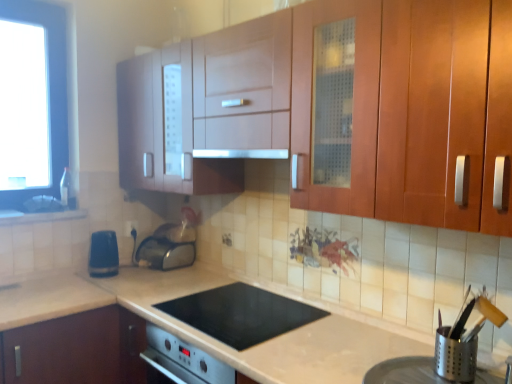
Question: Is silver metallic utensil holder at lower right, placed as the 4th appliance when sorted from left to right, far from blue plastic electric outlet at lower left?

Choices:
 (A) no
 (B) yes

Answer: (B)

Question: Could you tell me if silver metallic utensil holder at lower right, which appears as the third appliance when viewed from the back, is turned towards blue plastic electric outlet at lower left?

Choices:
 (A) no
 (B) yes

Answer: (A)

Question: Can you confirm if silver metallic utensil holder at lower right, which appears as the third appliance when viewed from the back, is wider than blue plastic electric outlet at lower left?

Choices:
 (A) no
 (B) yes

Answer: (B)

Question: From a real-world perspective, is silver metallic utensil holder at lower right, placed as the 4th appliance when sorted from left to right, located higher than blue plastic electric outlet at lower left?

Choices:
 (A) no
 (B) yes

Answer: (A)

Question: Is blue plastic electric outlet at lower left located within silver metallic utensil holder at lower right, which appears as the third appliance when viewed from the back?

Choices:
 (A) yes
 (B) no

Answer: (B)

Question: Based on their positions, is white glossy sink at lower left located to the left or right of blue plastic electric outlet at lower left?

Choices:
 (A) right
 (B) left

Answer: (B)

Question: Considering the positions of white glossy sink at lower left and blue plastic electric outlet at lower left in the image, is white glossy sink at lower left taller or shorter than blue plastic electric outlet at lower left?

Choices:
 (A) short
 (B) tall

Answer: (A)

Question: From a real-world perspective, is white glossy sink at lower left physically located above or below blue plastic electric outlet at lower left?

Choices:
 (A) below
 (B) above

Answer: (B)

Question: From the image's perspective, is white glossy sink at lower left positioned above or below blue plastic electric outlet at lower left?

Choices:
 (A) below
 (B) above

Answer: (B)

Question: From a real-world perspective, relative to satin silver toaster at lower center, positioned as the fourth appliance in front-to-back order, is silver metallic utensil holder at lower right, which is the 4th appliance in back-to-front order, vertically above or below?

Choices:
 (A) below
 (B) above

Answer: (A)

Question: Is point (370, 380) positioned closer to the camera than point (188, 258)?

Choices:
 (A) closer
 (B) farther

Answer: (A)

Question: Is silver metallic utensil holder at lower right, the third appliance positioned from the left, in front of or behind satin silver toaster at lower center, positioned as the fourth appliance in front-to-back order, in the image?

Choices:
 (A) front
 (B) behind

Answer: (A)

Question: Do you think silver metallic utensil holder at lower right, which is the 4th appliance in back-to-front order, is within satin silver toaster at lower center, which is the third appliance in right-to-left order, or outside of it?

Choices:
 (A) inside
 (B) outside

Answer: (B)

Question: From a real-world perspective, is black glass cooktop at center above or below blue plastic kettle at lower left, the first appliance from the left?

Choices:
 (A) below
 (B) above

Answer: (A)

Question: Is point click(x=190, y=324) closer or farther from the camera than point click(x=95, y=273)?

Choices:
 (A) closer
 (B) farther

Answer: (A)